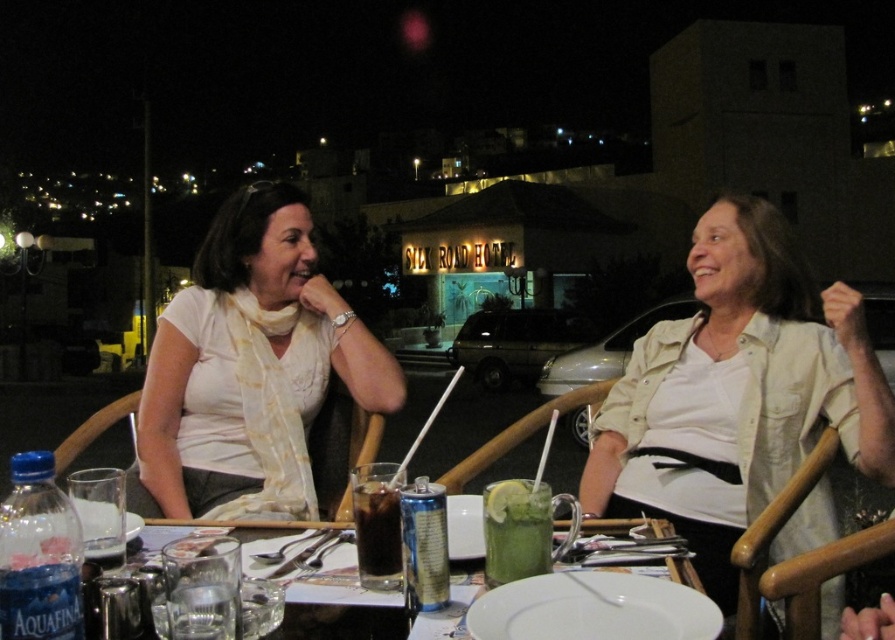
Does point (337, 612) come closer to viewer compared to point (492, 541)?

Yes, point (337, 612) is closer to viewer.

Between clear glass table at center and green glass drink at center, which one has less height?

clear glass table at center

Locate an element on the screen. This screenshot has width=895, height=640. clear glass table at center is located at coordinates (331, 596).

This screenshot has height=640, width=895. Identify the location of clear glass table at center. (331, 596).

Consider the image. Is clear glass table at center wider than dark brown glass at center?

Indeed, clear glass table at center has a greater width compared to dark brown glass at center.

Which is behind, point (283, 579) or point (382, 484)?

Point (382, 484)

This screenshot has height=640, width=895. I want to click on clear glass table at center, so click(331, 596).

Can you confirm if beige cotton shirt at center is positioned to the right of clear glass table at center?

Indeed, beige cotton shirt at center is positioned on the right side of clear glass table at center.

What do you see at coordinates (738, 390) in the screenshot? The width and height of the screenshot is (895, 640). I see `beige cotton shirt at center` at bounding box center [738, 390].

Is point (888, 464) closer to viewer compared to point (148, 525)?

No, (888, 464) is further to viewer.

Image resolution: width=895 pixels, height=640 pixels. In order to click on beige cotton shirt at center in this screenshot , I will do `click(738, 390)`.